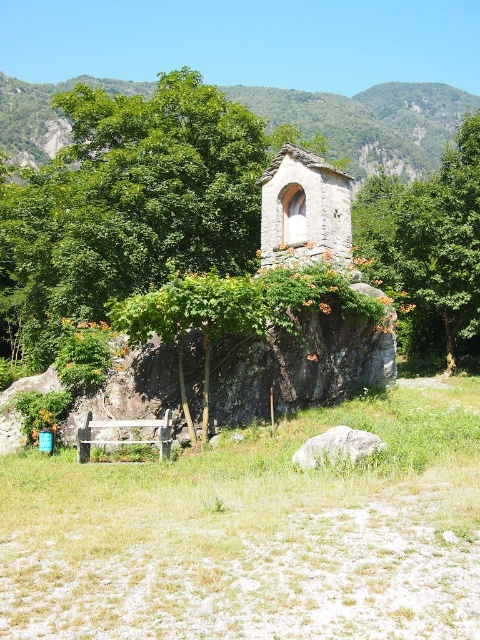
Question: Is green stone mountain at upper center below white smooth rock at center?

Choices:
 (A) yes
 (B) no

Answer: (B)

Question: Which of the following is the farthest from the observer?

Choices:
 (A) green stone mountain at upper center
 (B) stone wall at center
 (C) white smooth rock at center

Answer: (A)

Question: Does green leafy tree at center appear on the right side of green stone mountain at upper center?

Choices:
 (A) yes
 (B) no

Answer: (A)

Question: Which is nearer to the green leafy tree at center?

Choices:
 (A) white smooth rock at center
 (B) stone wall at center

Answer: (B)

Question: Which point is closer to the camera?

Choices:
 (A) (360, 173)
 (B) (460, 285)
 (C) (301, 164)
 (D) (360, 436)

Answer: (D)

Question: Observing the image, what is the correct spatial positioning of stone wall at center in reference to white smooth rock at center?

Choices:
 (A) left
 (B) right

Answer: (B)